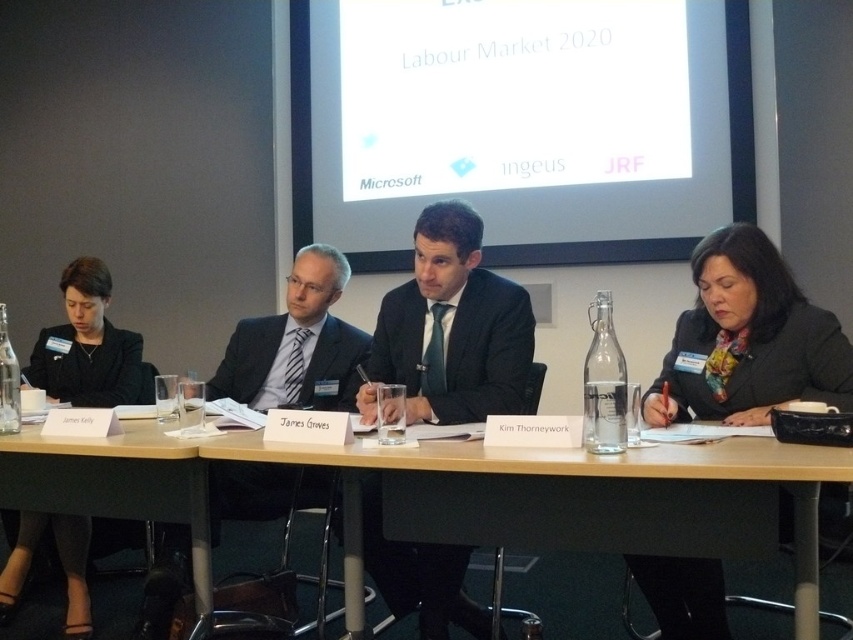
Is wooden table at center bigger than black fabric jacket at left?

Yes, wooden table at center is bigger than black fabric jacket at left.

Is wooden table at center behind black fabric jacket at left?

No, it is in front of black fabric jacket at left.

Find the location of a particular element. Image resolution: width=853 pixels, height=640 pixels. wooden table at center is located at coordinates (461, 493).

Describe the element at coordinates (747, 339) in the screenshot. I see `black woolen blazer at center` at that location.

Is black woolen blazer at center thinner than white matte projector screen at upper center?

Incorrect, black woolen blazer at center's width is not less than white matte projector screen at upper center's.

Who is more forward, (741,292) or (306,1)?

Point (741,292) is more forward.

Find the location of `black woolen blazer at center`. black woolen blazer at center is located at coordinates (747, 339).

From the picture: Who is lower down, dark gray suit at center or dark suit at center?

dark suit at center is below.

The height and width of the screenshot is (640, 853). I want to click on dark gray suit at center, so click(x=451, y=328).

Where is `dark gray suit at center`? This screenshot has width=853, height=640. dark gray suit at center is located at coordinates (451, 328).